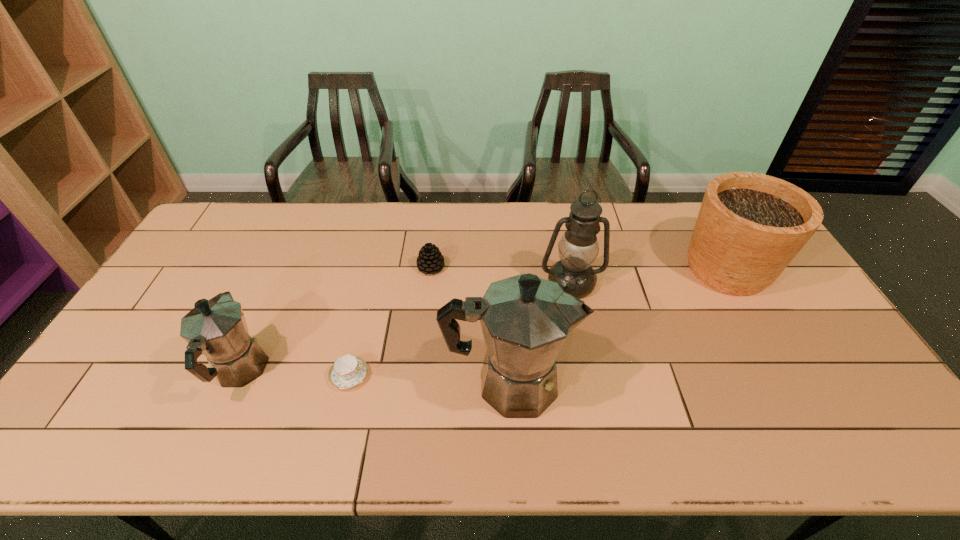
Locate which object ranks third in proximity to the right coffeepot. Please provide its 2D coordinates. Your answer should be formatted as a tuple, i.e. [(x, y)], where the tuple contains the x and y coordinates of a point satisfying the conditions above.

[(430, 260)]

Locate an element on the screen. The width and height of the screenshot is (960, 540). object that ranks as the fourth closest to the flowerpot is located at coordinates (348, 371).

At what (x,y) coordinates should I click in order to perform the action: click on free spot that satisfies the following two spatial constraints: 1. on the back side of the oil lamp; 2. at the narrow end of the fourth object from right to left. Please return your answer as a coordinate pair (x, y). The height and width of the screenshot is (540, 960). Looking at the image, I should click on (568, 267).

In order to click on free location that satisfies the following two spatial constraints: 1. on the pouring side of the oil lamp; 2. on the left side of the left coffeepot in this screenshot , I will do `click(279, 282)`.

Image resolution: width=960 pixels, height=540 pixels. Find the location of `free spot that satisfies the following two spatial constraints: 1. on the pouring side of the oil lamp; 2. on the right side of the leftmost object`. free spot that satisfies the following two spatial constraints: 1. on the pouring side of the oil lamp; 2. on the right side of the leftmost object is located at coordinates (279, 282).